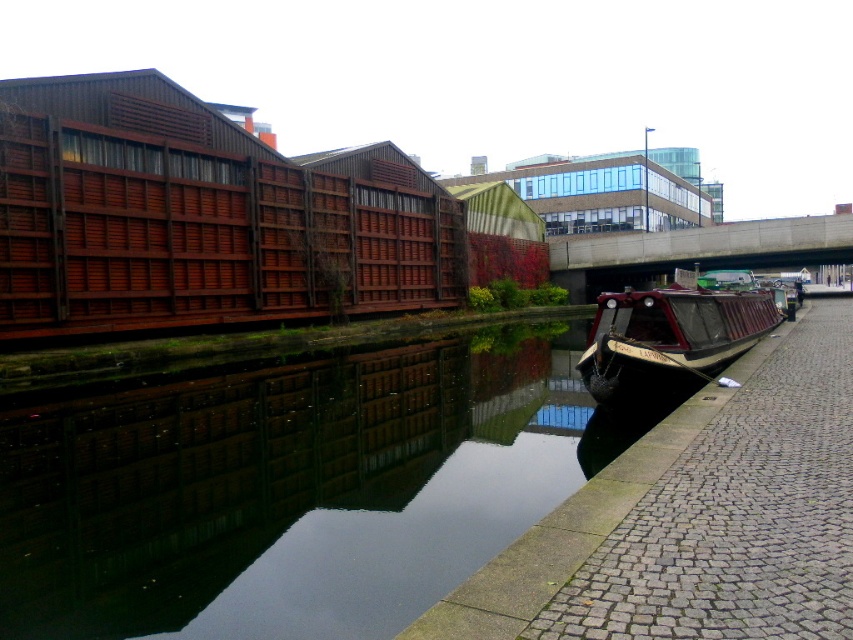
You are a photographer planning to capture the symmetry of the canal scene. You want to ensure the black reflective water at lower center and the wooden polished barge at right are both visible in your shot. Given their widths, which object should you prioritize framing closer to the center of the image to maintain balance?

The wooden polished barge at right has a greater width than the black reflective water at lower center, so to maintain balance in the composition, you should prioritize framing the wooden polished barge at right closer to the center of the image.

You are standing at the edge of the canal in the urban scene. You notice a point marked at coordinates (292, 490). What is the object located at that point?

The object located at coordinates (292, 490) is the black reflective water at lower center.